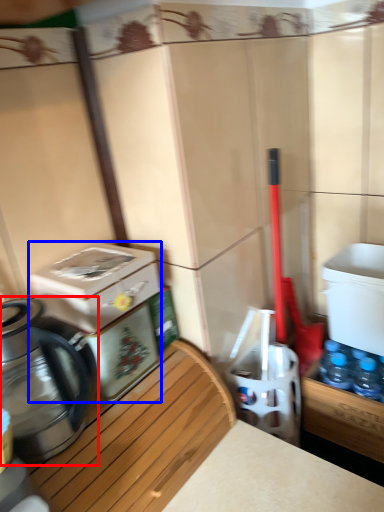
Question: Among these objects, which one is farthest to the camera, kettle (highlighted by a red box) or water cooler (highlighted by a blue box)?

Choices:
 (A) kettle
 (B) water cooler

Answer: (B)